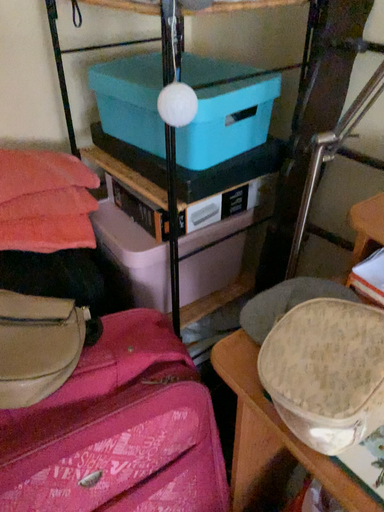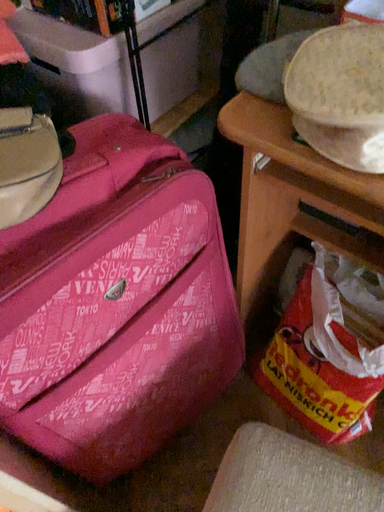
Question: Which way did the camera rotate in the video?

Choices:
 (A) rotated upward
 (B) rotated downward

Answer: (B)